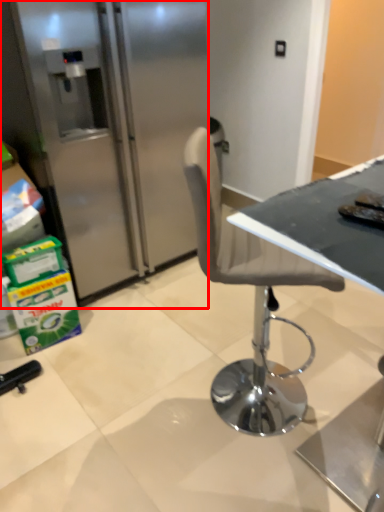
Question: Where is refrigerator (annotated by the red box) located in relation to table in the image?

Choices:
 (A) right
 (B) left

Answer: (B)